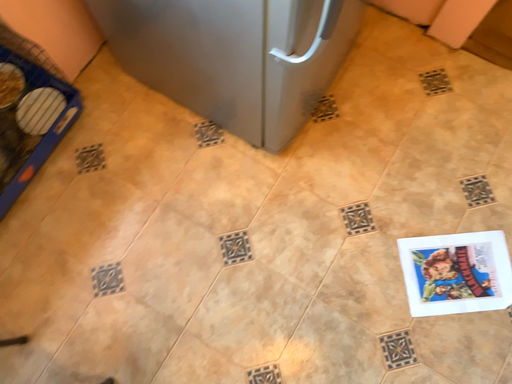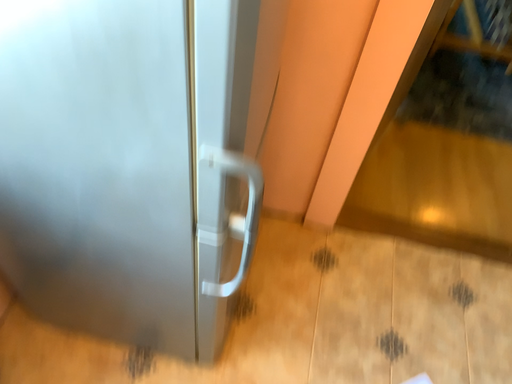
Question: Which way did the camera rotate in the video?

Choices:
 (A) rotated downward
 (B) rotated upward

Answer: (B)